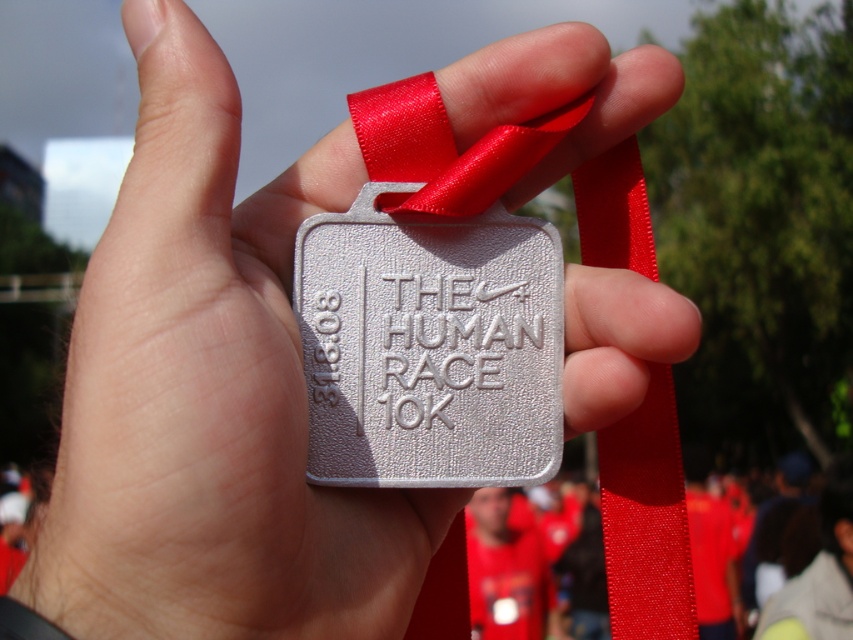
Can you confirm if silver textured medal at center is shorter than red satin ribbon at center?

Yes.

Which is in front, point (531, 252) or point (606, 472)?

Positioned in front is point (531, 252).

Image resolution: width=853 pixels, height=640 pixels. I want to click on silver textured medal at center, so click(x=430, y=346).